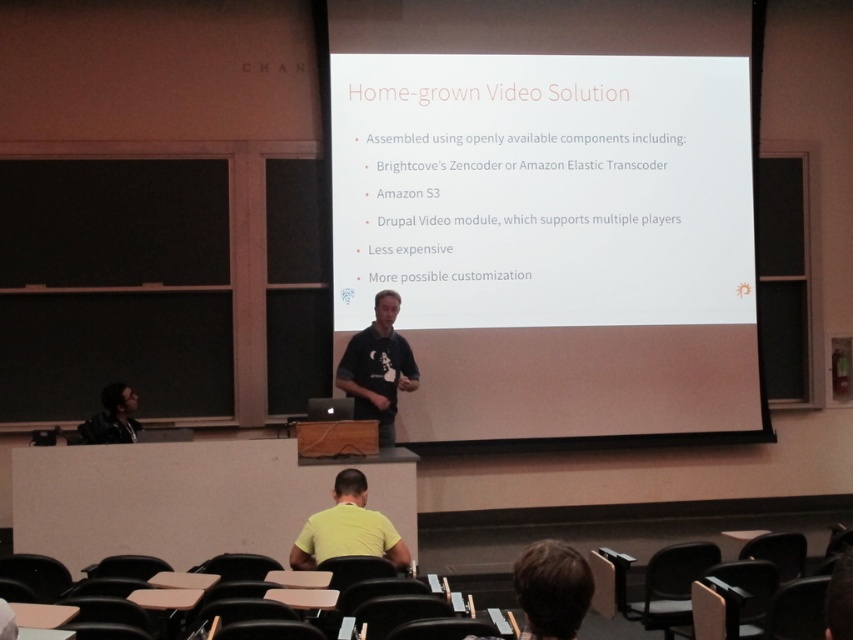
Who is more forward, (x=689, y=289) or (x=370, y=417)?

Positioned in front is point (x=370, y=417).

Between white matte projector screen at center and black t-shirt at center, which one is positioned lower?

black t-shirt at center

Describe the element at coordinates (550, 211) in the screenshot. I see `white matte projector screen at center` at that location.

At what (x,y) coordinates should I click in order to perform the action: click on white matte projector screen at center. Please return your answer as a coordinate pair (x, y). The height and width of the screenshot is (640, 853). Looking at the image, I should click on (550, 211).

Who is taller, yellow matte shirt at lower center or dark gray hoodie at lower left?

yellow matte shirt at lower center is taller.

What do you see at coordinates (347, 529) in the screenshot? The width and height of the screenshot is (853, 640). I see `yellow matte shirt at lower center` at bounding box center [347, 529].

You are a GUI agent. You are given a task and a screenshot of the screen. Output one action in this format:
    pyautogui.click(x=<x>, y=<y>)
    Task: Click on the yellow matte shirt at lower center
    
    Given the screenshot: What is the action you would take?
    pyautogui.click(x=347, y=529)

Is point (425, 413) positioned before point (106, 420)?

No.

Is white matte projector screen at center behind dark gray hoodie at lower left?

Yes, it is.

Find the location of `white matte projector screen at center`. white matte projector screen at center is located at coordinates (550, 211).